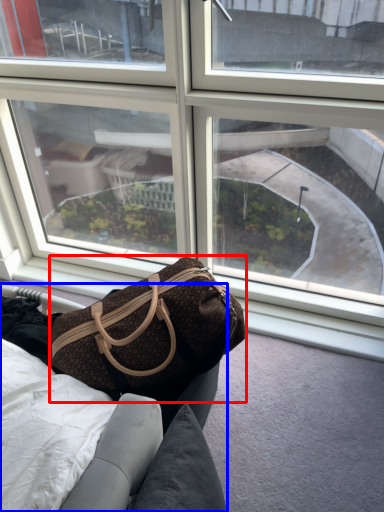
Question: Which object is closer to the camera taking this photo, handbag (highlighted by a red box) or furniture (highlighted by a blue box)?

Choices:
 (A) handbag
 (B) furniture

Answer: (A)